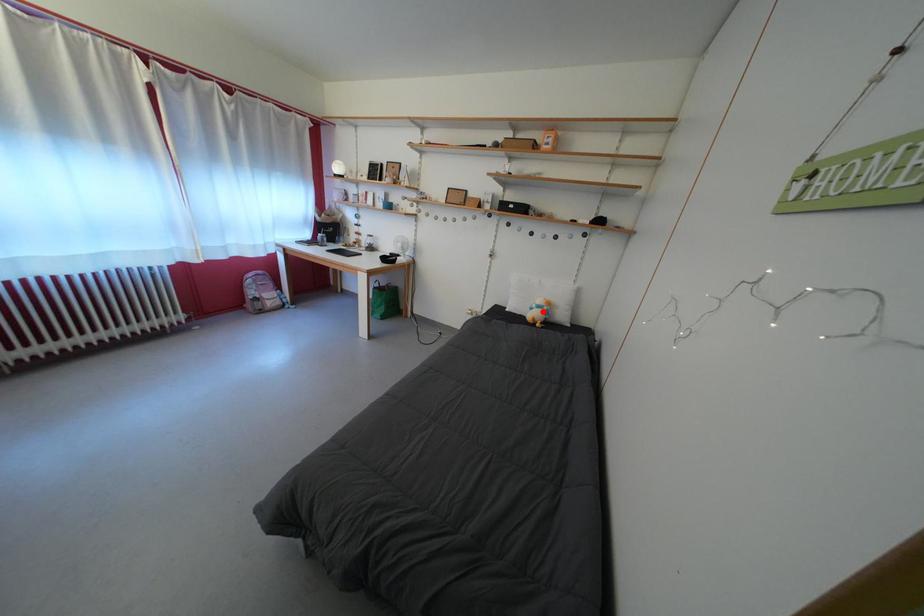
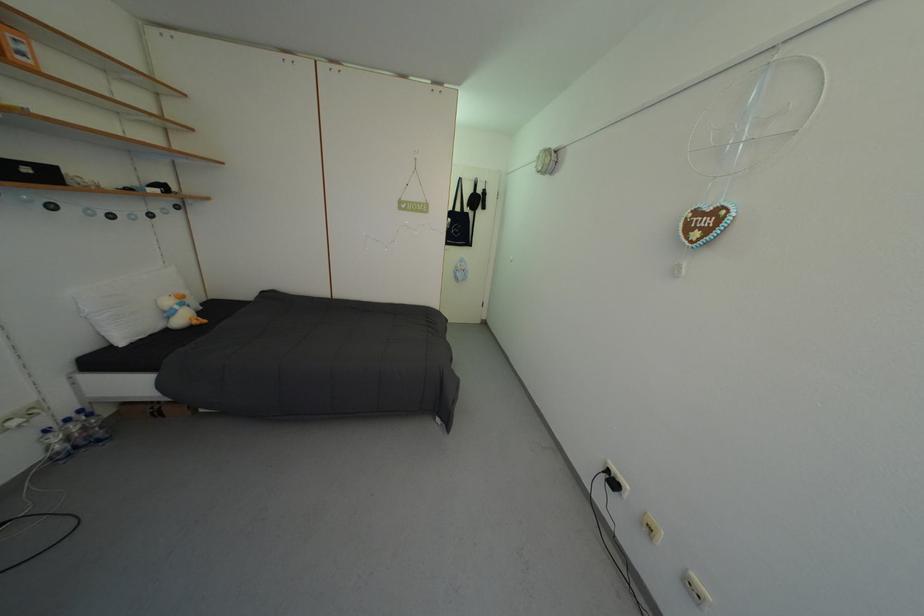
Question: A red point is marked in image1. In image2, is the corresponding 3D point closer to the camera or farther? Reply with the corresponding letter.

Choices:
 (A) The corresponding 3D point is closer.
 (B) The corresponding 3D point is farther.

Answer: (A)